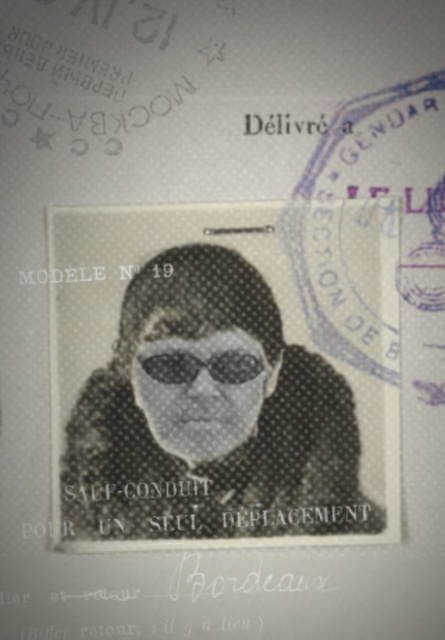
In the scene shown: You are examining a historical document and notice two items at the center of the image. Which one appears closer to you between the black textured hair at center and the black matte goggles at center?

The black textured hair at center is closer to the viewer than the black matte goggles at center.

You are holding a magnifying glass and need to examine the document closely. The point you want to inspect is located at point (199, 301). Considering the distance between this point and your eye, which is 37.97 inches, can you determine if you need to adjust the magnifying glass to focus on this point?

The point (199, 301) is 37.97 inches away from the camera. To focus the magnifying glass, you should adjust it to a focal length that matches this distance so you can clearly see the details at that point.